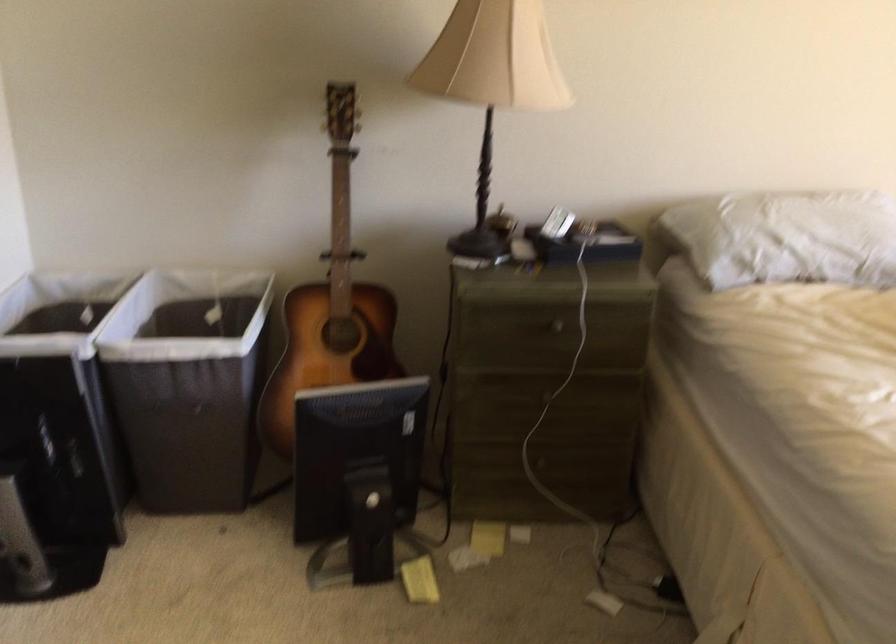
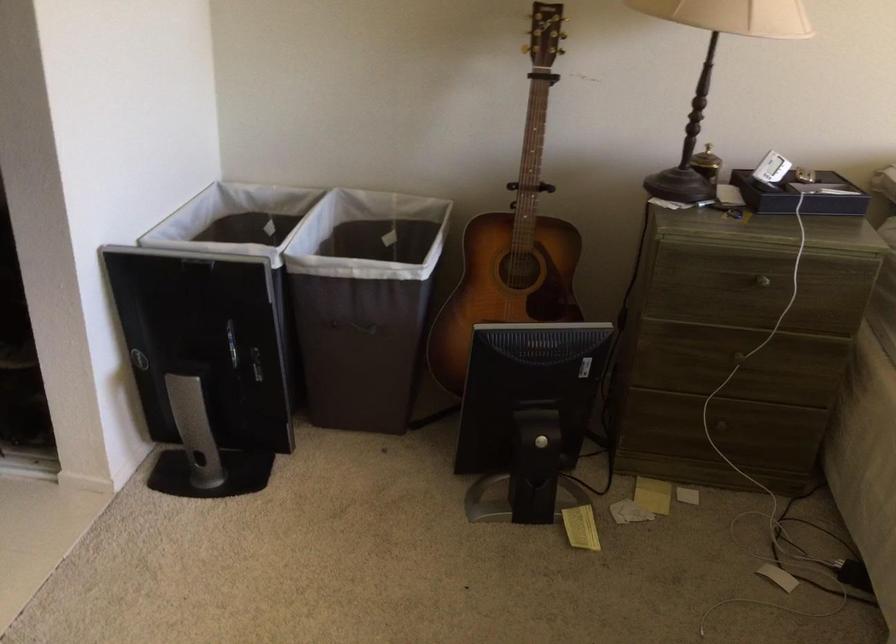
Find the pixel in the second image that matches point 333,306 in the first image.

(513, 237)